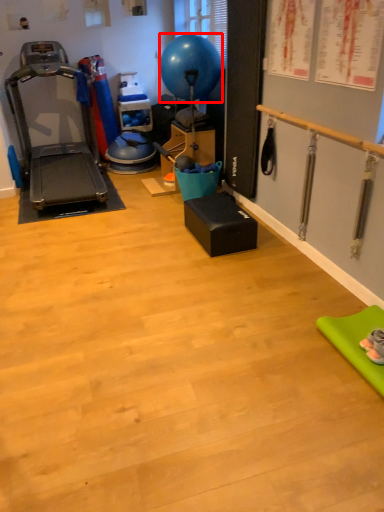
Question: Considering the relative positions of balloon (annotated by the red box) and treadmill in the image provided, where is balloon (annotated by the red box) located with respect to the staircase?

Choices:
 (A) left
 (B) right

Answer: (B)